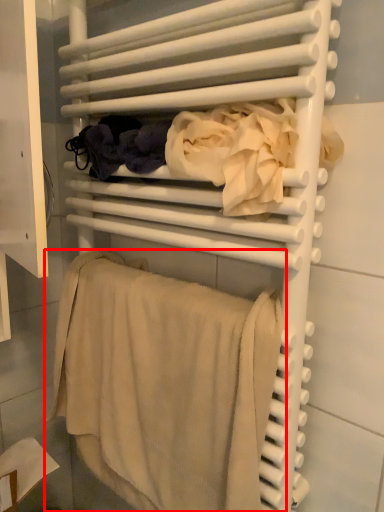
Question: From the image's perspective, where is towel (annotated by the red box) located relative to clothing?

Choices:
 (A) below
 (B) above

Answer: (A)